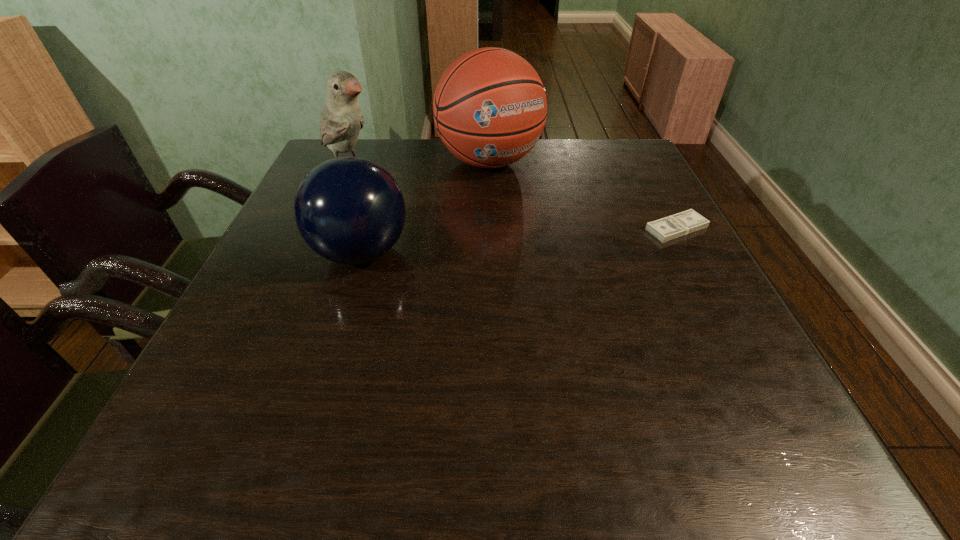
Identify the location of vacant space at the near edge of the desktop. The image size is (960, 540). (423, 381).

In the image, there is a desktop. Find the location of `vacant space at the left edge`. vacant space at the left edge is located at coordinates click(268, 242).

Where is `vacant space at the right edge`? vacant space at the right edge is located at coordinates (721, 359).

What are the coordinates of `free space at the near left corner` in the screenshot? It's located at (216, 372).

Locate an element on the screen. This screenshot has height=540, width=960. vacant point at the far right corner is located at coordinates (612, 161).

In order to click on vacant region between the bird and the second object from right to left in this screenshot , I will do `click(420, 165)`.

I want to click on unoccupied position between the basketball and the bird, so click(x=420, y=165).

This screenshot has height=540, width=960. Identify the location of empty space that is in between the basketball and the shortest object. (583, 195).

Locate an element on the screen. This screenshot has width=960, height=540. vacant area that lies between the shortest object and the bowling ball is located at coordinates click(x=518, y=240).

The width and height of the screenshot is (960, 540). What are the coordinates of `empty space between the shortest object and the basketball` in the screenshot? It's located at [583, 195].